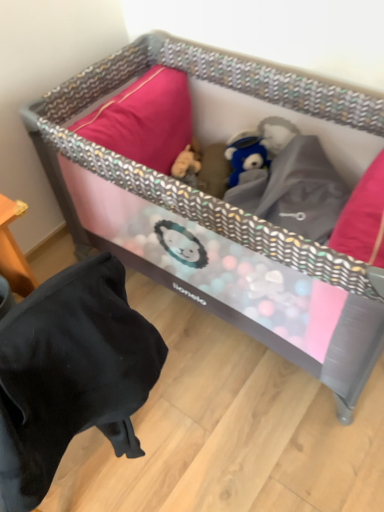
Locate an element on the screen. This screenshot has width=384, height=512. free location to the right of black fabric bean bag chair at lower left is located at coordinates (205, 425).